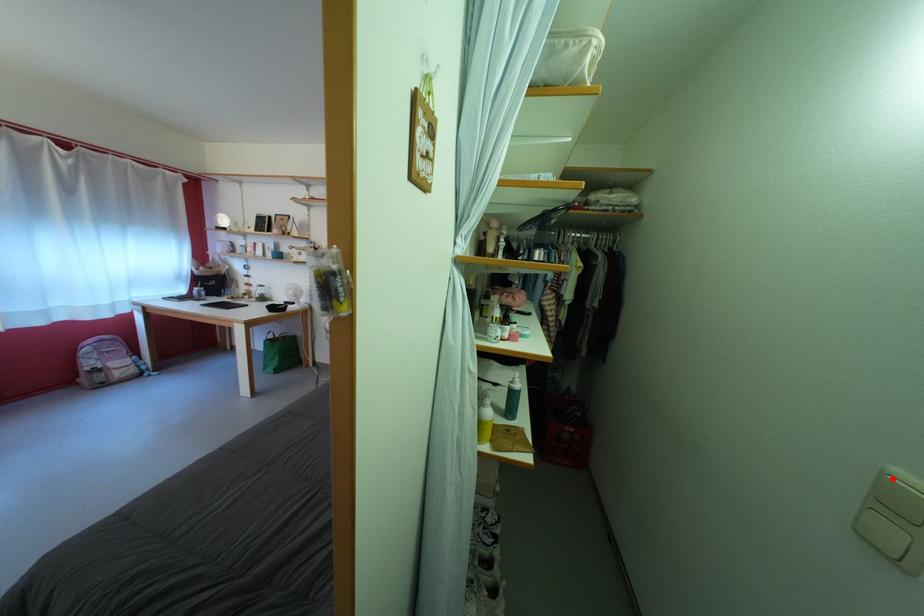
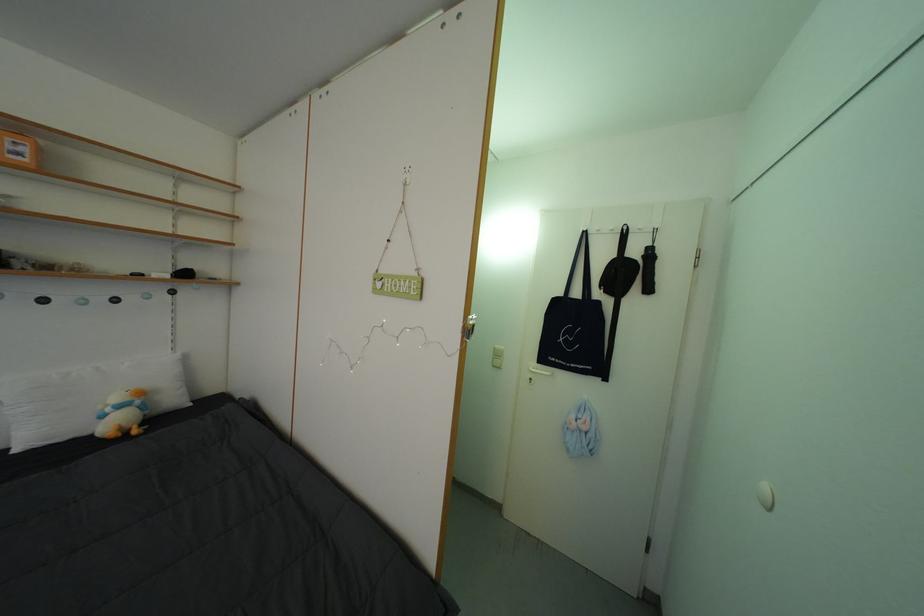
In the second image, find the point that corresponds to the highlighted location in the first image.

(504, 354)